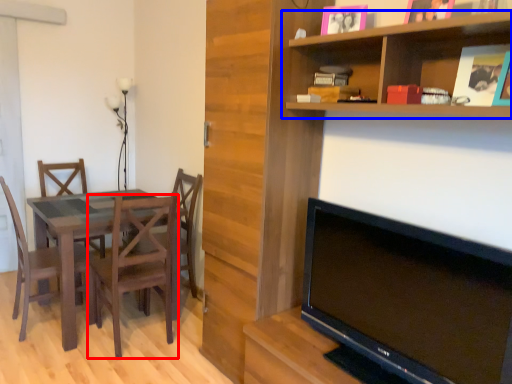
Question: Which of the following is the farthest to the observer, chair (highlighted by a red box) or shelf (highlighted by a blue box)?

Choices:
 (A) chair
 (B) shelf

Answer: (A)